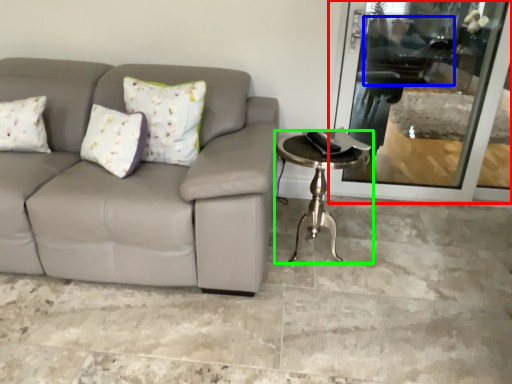
Question: Based on their relative distances, which object is farther from screen door (highlighted by a red box)? Choose from swivel chair (highlighted by a blue box) and table (highlighted by a green box).

Choices:
 (A) swivel chair
 (B) table

Answer: (B)